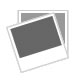
Where is `corner`? Image resolution: width=80 pixels, height=80 pixels. corner is located at coordinates click(49, 20).